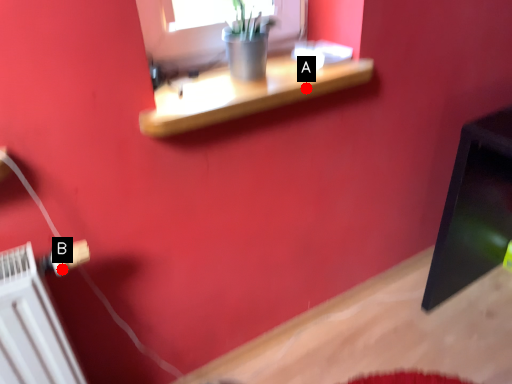
Question: Two points are circled on the image, labeled by A and B beside each circle. Which point is farther from the camera taking this photo?

Choices:
 (A) A is further
 (B) B is further

Answer: (A)